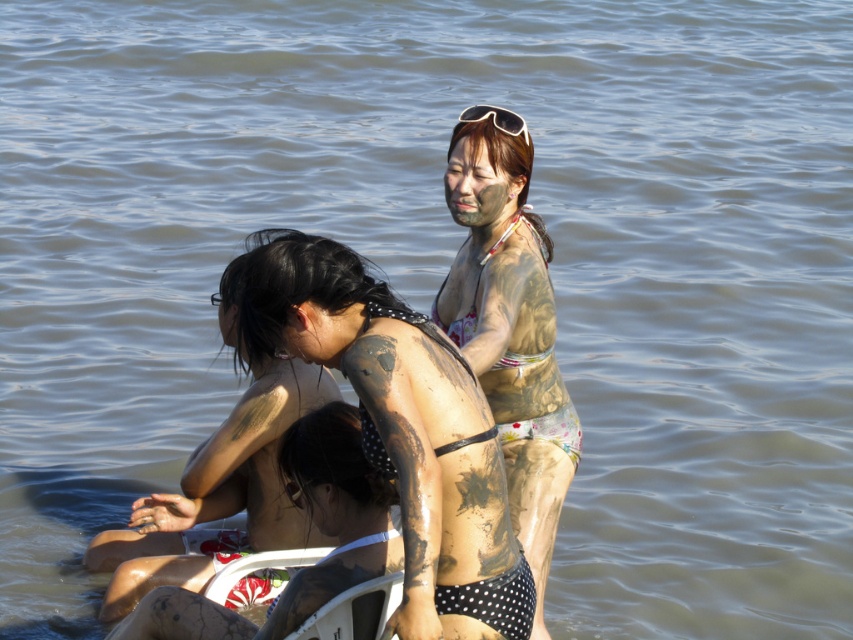
Question: Which point is closer to the camera taking this photo?

Choices:
 (A) (370, 330)
 (B) (294, 579)
 (C) (451, 264)
 (D) (466, 214)

Answer: (A)

Question: Which object is the farthest from the matte mud face at center?

Choices:
 (A) dark brown mud at center
 (B) white plastic goggles at upper center
 (C) matte skin at center

Answer: (B)

Question: Which point appears farthest from the camera in this image?

Choices:
 (A) (469, 115)
 (B) (299, 324)
 (C) (375, 548)
 (D) (514, 579)

Answer: (A)

Question: In this image, where is dark brown mud at center located relative to matte skin at center?

Choices:
 (A) above
 (B) below

Answer: (B)

Question: Does muddy skin bikini at upper center have a lesser width compared to matte mud face at center?

Choices:
 (A) no
 (B) yes

Answer: (A)

Question: Does dark brown mud at center have a greater width compared to matte skin at center?

Choices:
 (A) yes
 (B) no

Answer: (A)